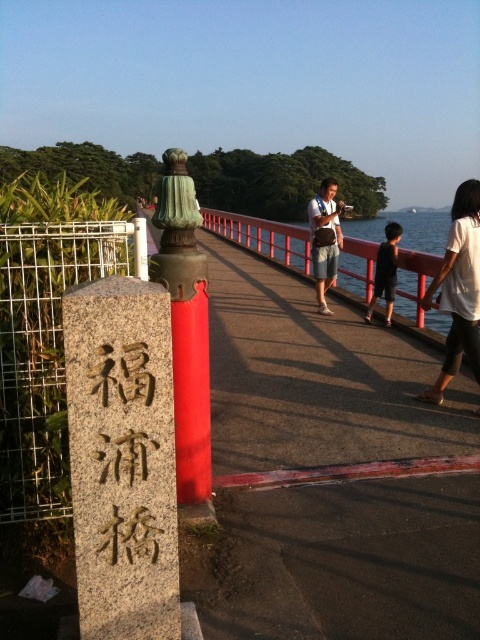
Question: Among these objects, which one is nearest to the camera?

Choices:
 (A) black matte shirt at center
 (B) granite stone pillar at left
 (C) gold stone writing at center
 (D) white cotton shirt at right

Answer: (B)

Question: Does light brown leather bag at center have a larger size compared to black matte shirt at center?

Choices:
 (A) yes
 (B) no

Answer: (A)

Question: Does light brown leather bag at center come behind black matte shirt at center?

Choices:
 (A) no
 (B) yes

Answer: (B)

Question: Among these objects, which one is nearest to the camera?

Choices:
 (A) black matte shirt at center
 (B) red polished wood post at center
 (C) granite stone pillar at left
 (D) gold stone writing at center

Answer: (C)

Question: Which of the following is the farthest from the observer?

Choices:
 (A) light brown leather bag at center
 (B) white cotton shirt at right
 (C) black matte shirt at center

Answer: (A)

Question: Is granite stone pillar at left thinner than black matte shirt at center?

Choices:
 (A) no
 (B) yes

Answer: (B)